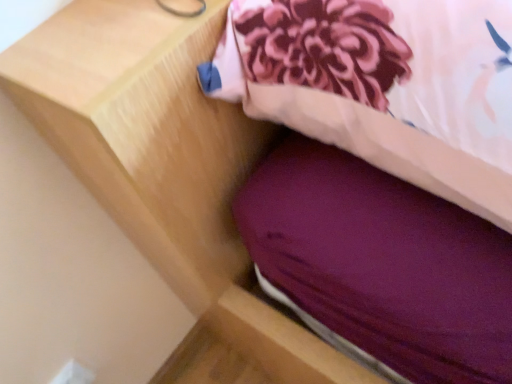
Question: Should I look upward or downward to see matte purple pillow at upper right?

Choices:
 (A) up
 (B) down

Answer: (A)